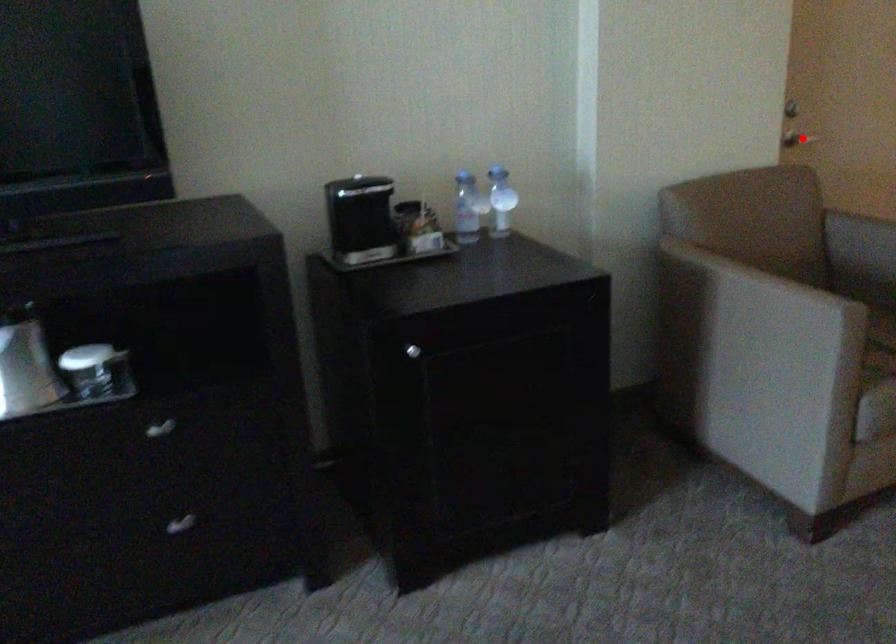
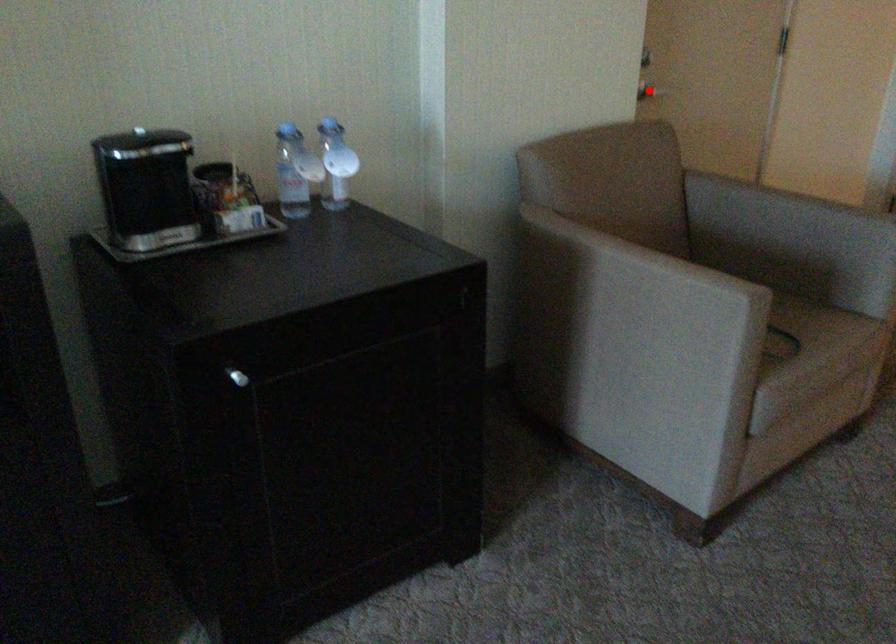
I am providing you with two images of the same scene from different viewpoints. A red point is marked on the first image and another point is marked on the second image. Is the marked point in image1 the same physical position as the marked point in image2?

Yes